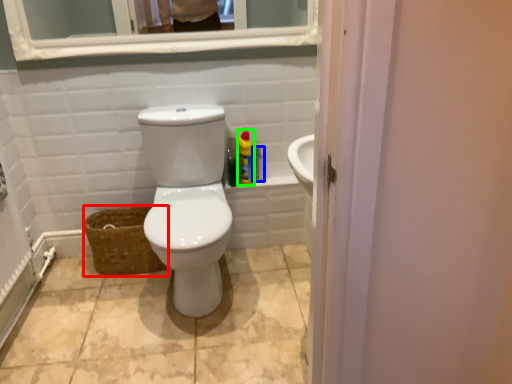
Question: Which is farther away from basket (highlighted by a red box)? cleaning product (highlighted by a blue box) or cleaning product (highlighted by a green box)?

Choices:
 (A) cleaning product
 (B) cleaning product

Answer: (A)